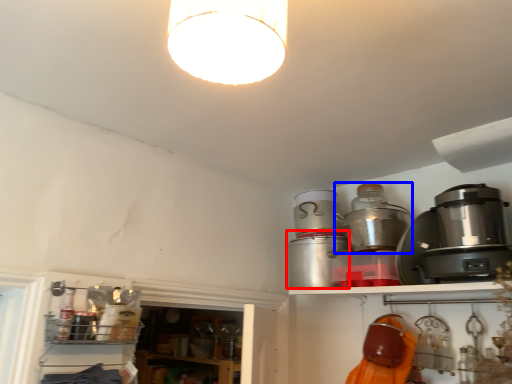
Question: Which object appears closest to the camera in this image, appliance (highlighted by a red box) or appliance (highlighted by a blue box)?

Choices:
 (A) appliance
 (B) appliance

Answer: (B)